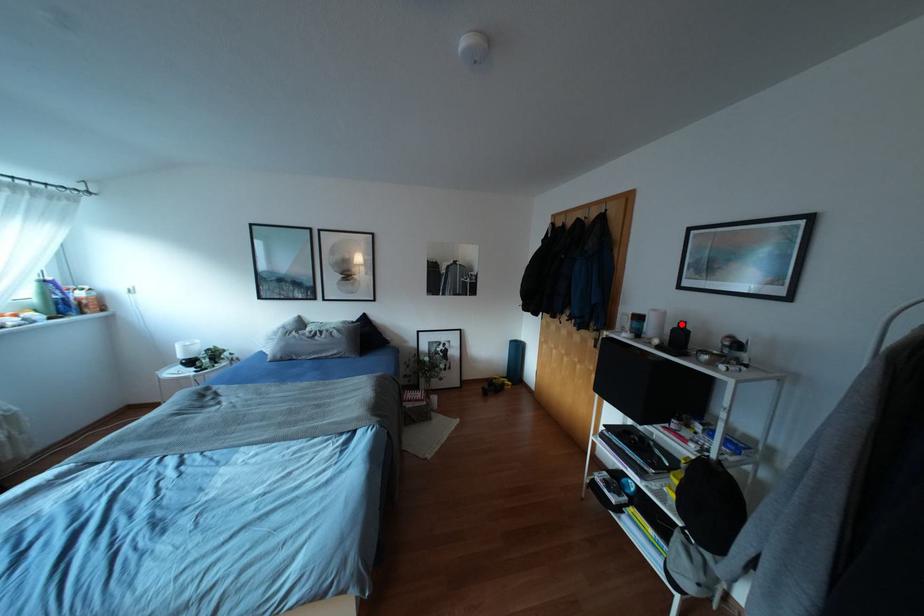
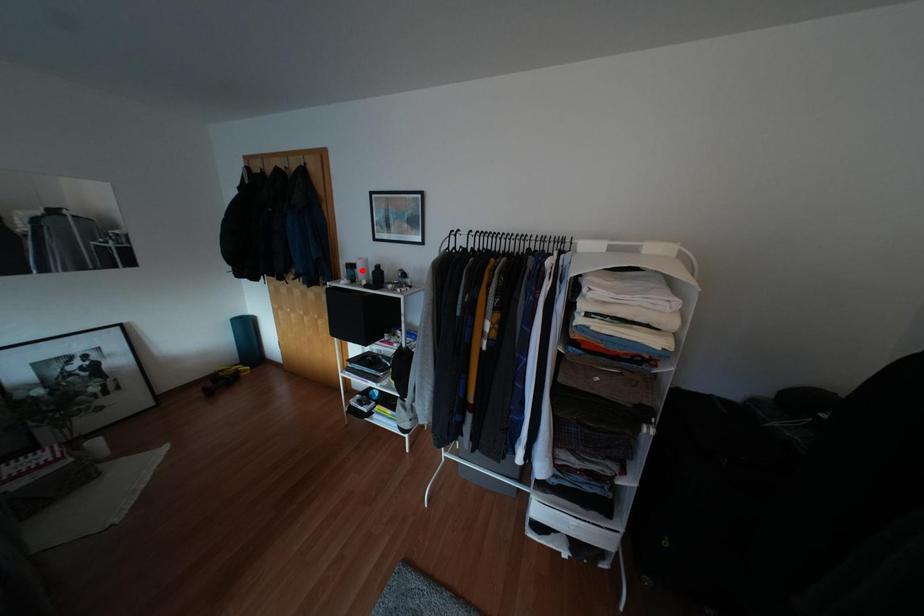
I am providing you with two images of the same scene from different viewpoints. A red point is marked on the first image and another point is marked on the second image. Is the red point in image1 aligned with the point shown in image2?

No